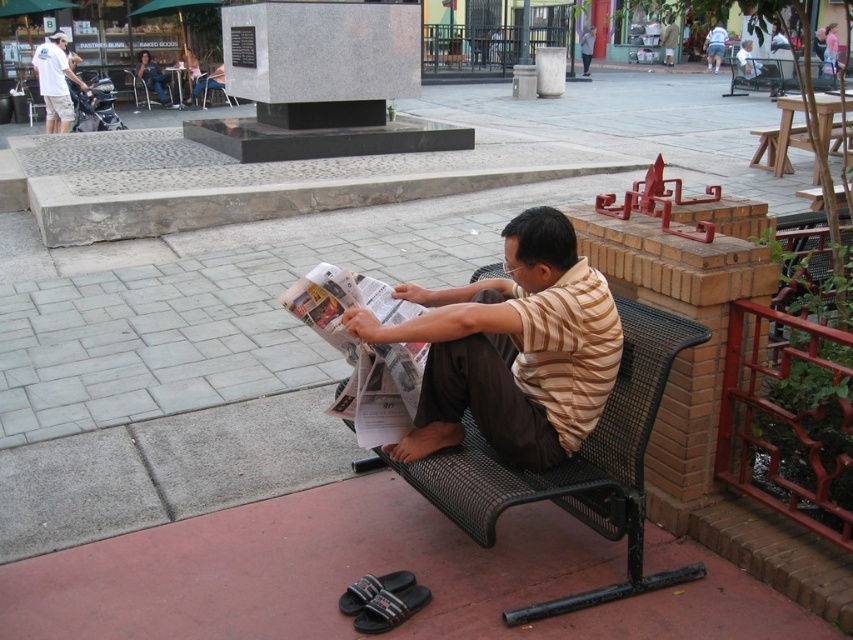
Which is behind, point (604, 328) or point (71, 76)?

Point (71, 76)

Is point (485, 371) closer to camera compared to point (62, 115)?

Yes, point (485, 371) is closer to viewer.

Where is `brown striped shirt at center`? This screenshot has width=853, height=640. brown striped shirt at center is located at coordinates (511, 349).

Identify the location of brown striped shirt at center. (511, 349).

Who is more forward, (x=602, y=422) or (x=671, y=61)?

Positioned in front is point (x=602, y=422).

Is point (604, 474) closer to camera compared to point (665, 60)?

Yes, it is in front of point (665, 60).

Where is `black mesh park bench at center`? The width and height of the screenshot is (853, 640). black mesh park bench at center is located at coordinates (573, 465).

The image size is (853, 640). I want to click on black mesh park bench at center, so click(573, 465).

From the picture: Who is positioned more to the right, black mesh park bench at center or denim shorts at lower right?

Positioned to the right is denim shorts at lower right.

Which is in front, point (379, 458) or point (709, 44)?

Point (379, 458) is in front.

This screenshot has width=853, height=640. In order to click on black mesh park bench at center in this screenshot , I will do `click(573, 465)`.